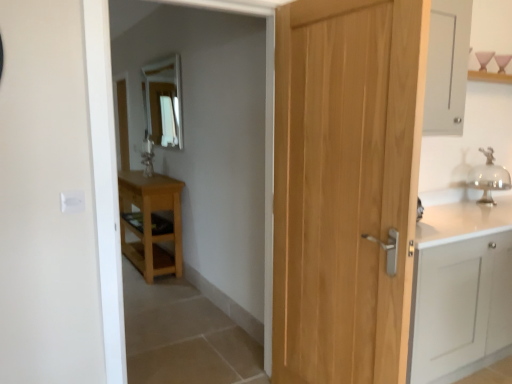
Question: Is clear glass mirror at upper center bigger than light brown wood door at center?

Choices:
 (A) no
 (B) yes

Answer: (A)

Question: From the image's perspective, is clear glass mirror at upper center beneath light brown wood door at center?

Choices:
 (A) yes
 (B) no

Answer: (B)

Question: Considering the relative sizes of clear glass mirror at upper center and light brown wood door at center in the image provided, is clear glass mirror at upper center wider than light brown wood door at center?

Choices:
 (A) no
 (B) yes

Answer: (A)

Question: Is clear glass mirror at upper center taller than light brown wood door at center?

Choices:
 (A) yes
 (B) no

Answer: (B)

Question: Does clear glass mirror at upper center lie behind light brown wood door at center?

Choices:
 (A) yes
 (B) no

Answer: (A)

Question: In terms of width, does light wood table at left look wider or thinner when compared to clear glass bell at right?

Choices:
 (A) wide
 (B) thin

Answer: (A)

Question: Is light wood table at left taller or shorter than clear glass bell at right?

Choices:
 (A) tall
 (B) short

Answer: (A)

Question: Is light wood table at left inside or outside of clear glass bell at right?

Choices:
 (A) inside
 (B) outside

Answer: (B)

Question: Is point (177, 228) positioned closer to the camera than point (484, 152)?

Choices:
 (A) closer
 (B) farther

Answer: (B)

Question: From a real-world perspective, relative to clear glass bell at right, is clear glass mirror at upper center vertically above or below?

Choices:
 (A) above
 (B) below

Answer: (A)

Question: Visually, is clear glass mirror at upper center positioned to the left or to the right of clear glass bell at right?

Choices:
 (A) left
 (B) right

Answer: (A)

Question: From the image's perspective, is clear glass mirror at upper center located above or below clear glass bell at right?

Choices:
 (A) below
 (B) above

Answer: (B)

Question: Is point (163, 61) closer or farther from the camera than point (501, 175)?

Choices:
 (A) closer
 (B) farther

Answer: (B)

Question: From a real-world perspective, is light brown wood door at center positioned above or below clear glass mirror at upper center?

Choices:
 (A) below
 (B) above

Answer: (A)

Question: Based on their sizes in the image, would you say light brown wood door at center is bigger or smaller than clear glass mirror at upper center?

Choices:
 (A) big
 (B) small

Answer: (A)